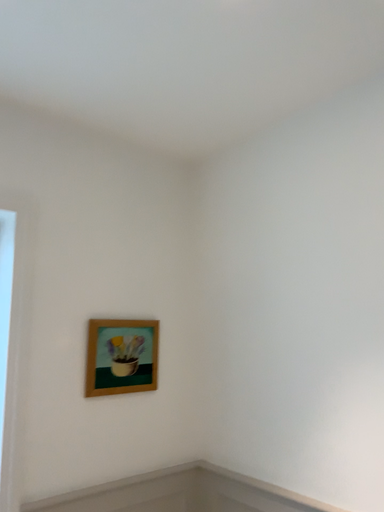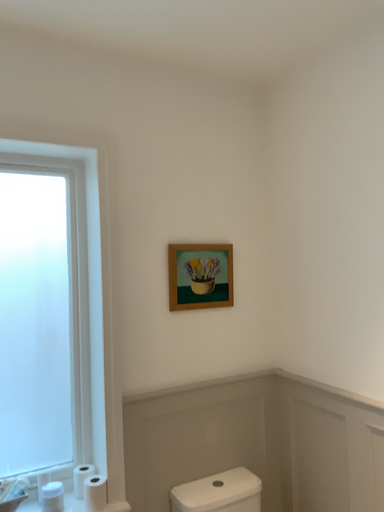
Question: How did the camera likely rotate when shooting the video?

Choices:
 (A) rotated left
 (B) rotated right

Answer: (A)